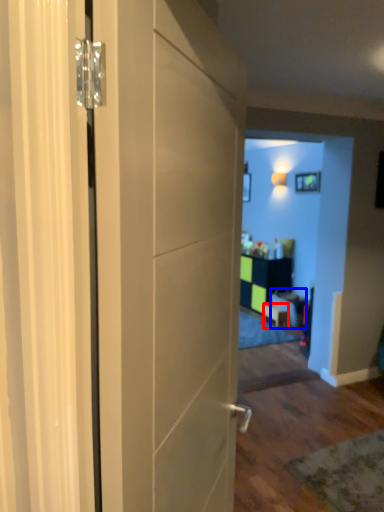
Question: Which object appears closest to the camera in this image, furniture (highlighted by a red box) or furniture (highlighted by a blue box)?

Choices:
 (A) furniture
 (B) furniture

Answer: (B)